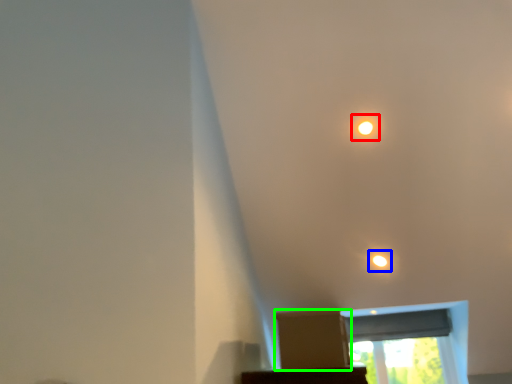
Question: Which object is the closest to the dot (highlighted by a red box)? Choose among these: light (highlighted by a blue box) or cardboard box (highlighted by a green box).

Choices:
 (A) light
 (B) cardboard box

Answer: (A)